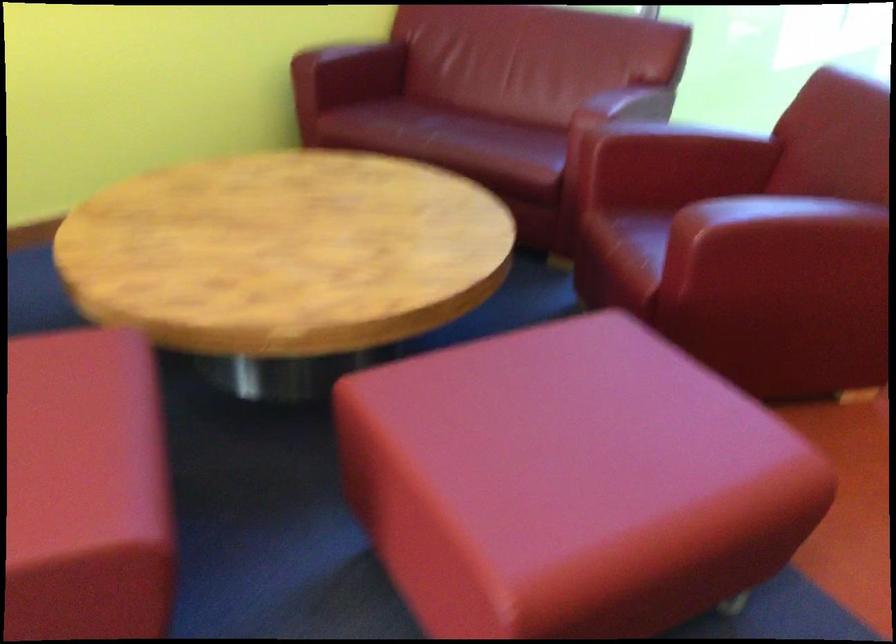
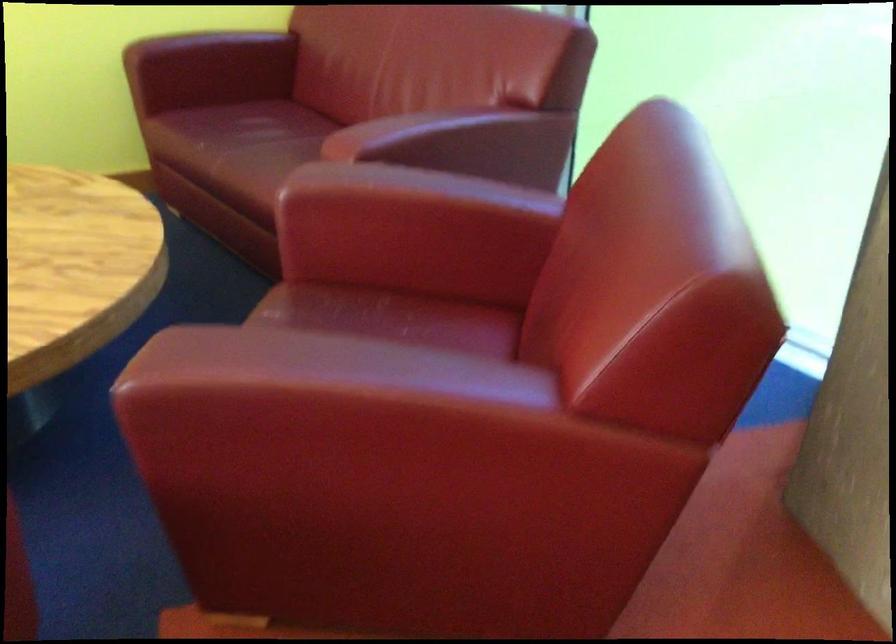
Find the pixel in the second image that matches (677,163) in the first image.

(412, 231)